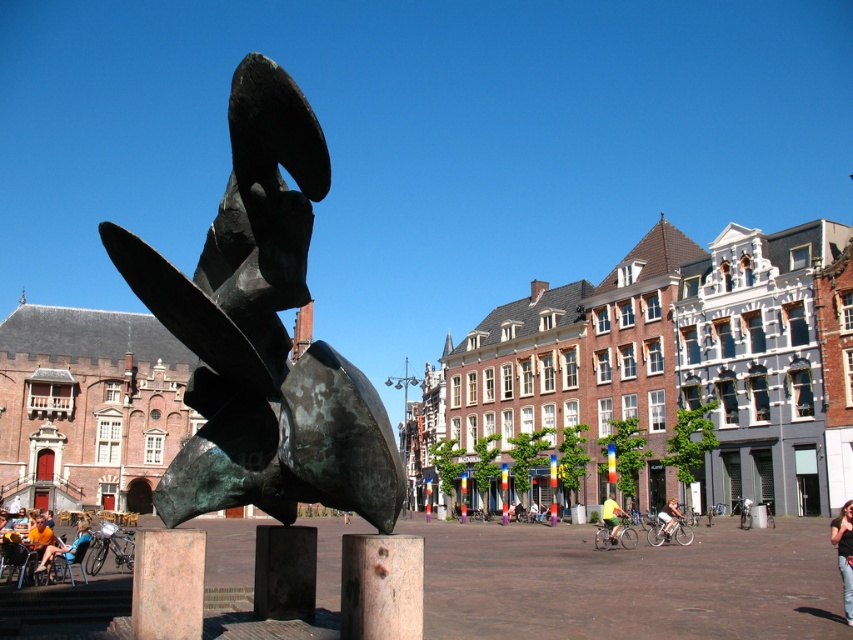
You are standing in the urban square and see the denim pants at lower right. Where exactly are they located in the square?

The denim pants at lower right are located at point coordinates of (844, 554).

Based on the photo, you are standing in the urban square and want to take a photo of the two points mentioned. Which point is closer to you, point [846,589] or point [38,566]?

Point [846,589] is closer to the viewer than point [38,566].